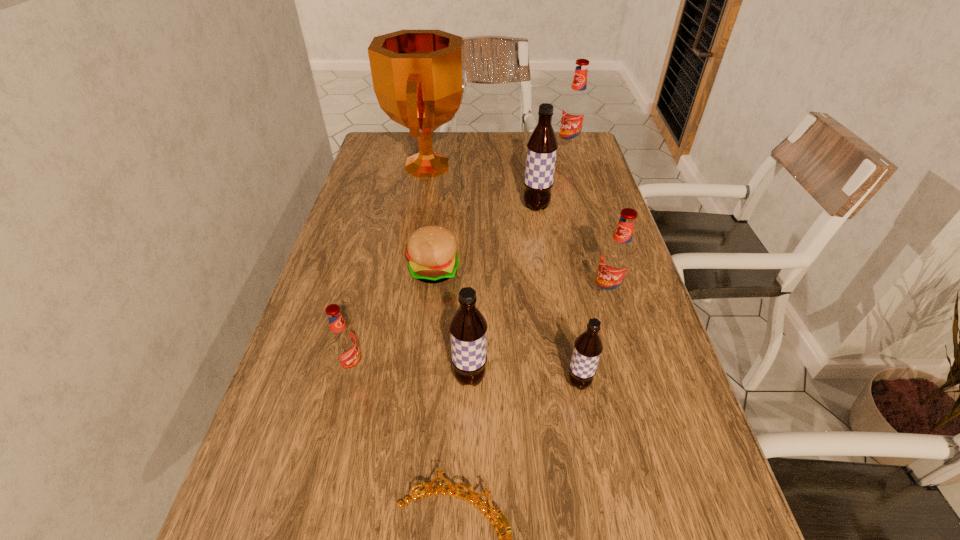
You are a GUI agent. You are given a task and a screenshot of the screen. Output one action in this format:
    pyautogui.click(x=<x>, y=<y>)
    Task: Click on the gold award
    The image size is (960, 540).
    Given the screenshot: What is the action you would take?
    pyautogui.click(x=419, y=80)

This screenshot has height=540, width=960. In order to click on award in this screenshot , I will do `click(419, 80)`.

Where is `the biggest red root beer`? The height and width of the screenshot is (540, 960). the biggest red root beer is located at coordinates (575, 109).

You are a GUI agent. You are given a task and a screenshot of the screen. Output one action in this format:
    pyautogui.click(x=<x>, y=<y>)
    Task: Click on the farthest red root beer
    This screenshot has width=960, height=540.
    Given the screenshot: What is the action you would take?
    pyautogui.click(x=575, y=109)

Where is `the biggest brown root beer`? The width and height of the screenshot is (960, 540). the biggest brown root beer is located at coordinates (542, 145).

This screenshot has width=960, height=540. Find the location of `the second farthest root beer`. the second farthest root beer is located at coordinates (542, 145).

Find the location of a particular element. The height and width of the screenshot is (540, 960). the second smallest red root beer is located at coordinates (616, 259).

What are the coordinates of `the second nearest red root beer` in the screenshot? It's located at (616, 259).

The height and width of the screenshot is (540, 960). I want to click on the second biggest brown root beer, so click(x=468, y=328).

In order to click on the leftmost brown root beer in this screenshot , I will do `click(468, 328)`.